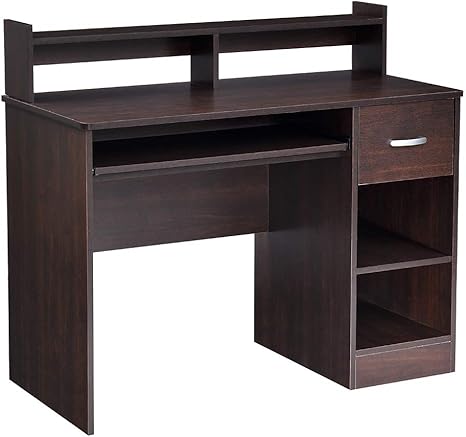
Image resolution: width=466 pixels, height=437 pixels. I want to click on dark black vertical lines on the side of the desk, so click(x=46, y=256), click(x=36, y=252), click(x=47, y=155), click(x=64, y=157), click(x=32, y=165), click(x=18, y=165).